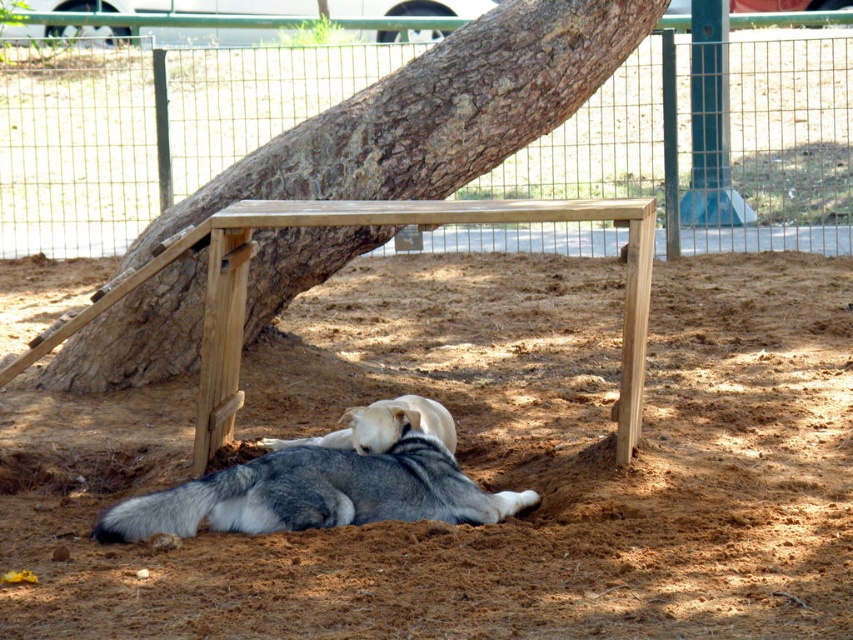
You are a gardener trying to place a new plant pot that is 1 meter wide between the green wire mesh at upper center and the gray fur dog at center. Based on the scene, will the pot fit between them?

The green wire mesh at upper center is narrower than the gray fur dog at center. However, the exact distance between them isn not specified. Without knowing the actual space between the two objects, it is impossible to determine if the 1 meter wide plant pot will fit.

You are a visitor at the park and see two dogs resting under the tree. The gray fur dog at center and the light brown fur at center. Which dog is positioned more to the left side?

The gray fur dog at center is positioned more to the left side than the light brown fur at center.

Consider the image. You are standing in front of the tree and want to place a small flowerpot between the two points, point [253,497] and point [300,440]. Since you want the flowerpot to be closer to the camera, which point should you place it near?

You should place the flowerpot near point [253,497] because it is closer to the camera than point [300,440].